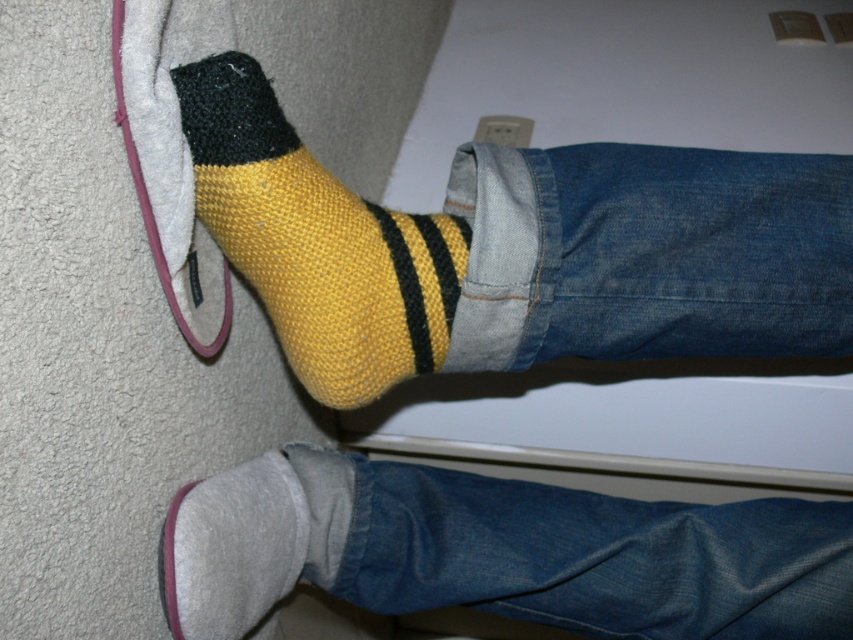
Can you confirm if yellow knitted sock at lower left is taller than gray fuzzy slipper at lower left?

Correct, yellow knitted sock at lower left is much taller as gray fuzzy slipper at lower left.

Is point (431, 326) farther from viewer compared to point (233, 630)?

Yes, it is behind point (233, 630).

You are a GUI agent. You are given a task and a screenshot of the screen. Output one action in this format:
    pyautogui.click(x=<x>, y=<y>)
    Task: Click on the yellow knitted sock at lower left
    This screenshot has width=853, height=640.
    Given the screenshot: What is the action you would take?
    pyautogui.click(x=316, y=241)

What do you see at coordinates (518, 250) in the screenshot?
I see `yellow knitted sock at upper left` at bounding box center [518, 250].

Is point (636, 314) behind point (315, 198)?

Yes, point (636, 314) is farther from viewer.

I want to click on yellow knitted sock at upper left, so click(518, 250).

Can you confirm if gray fabric sock at lower left is positioned below gray fuzzy slipper at lower left?

Indeed, gray fabric sock at lower left is positioned under gray fuzzy slipper at lower left.

Does gray fabric sock at lower left appear over gray fuzzy slipper at lower left?

No, gray fabric sock at lower left is not above gray fuzzy slipper at lower left.

Is point (663, 636) behind point (194, 516)?

Yes, it is.

You are a GUI agent. You are given a task and a screenshot of the screen. Output one action in this format:
    pyautogui.click(x=<x>, y=<y>)
    Task: Click on the gray fabric sock at lower left
    The image size is (853, 640).
    Given the screenshot: What is the action you would take?
    pyautogui.click(x=498, y=552)